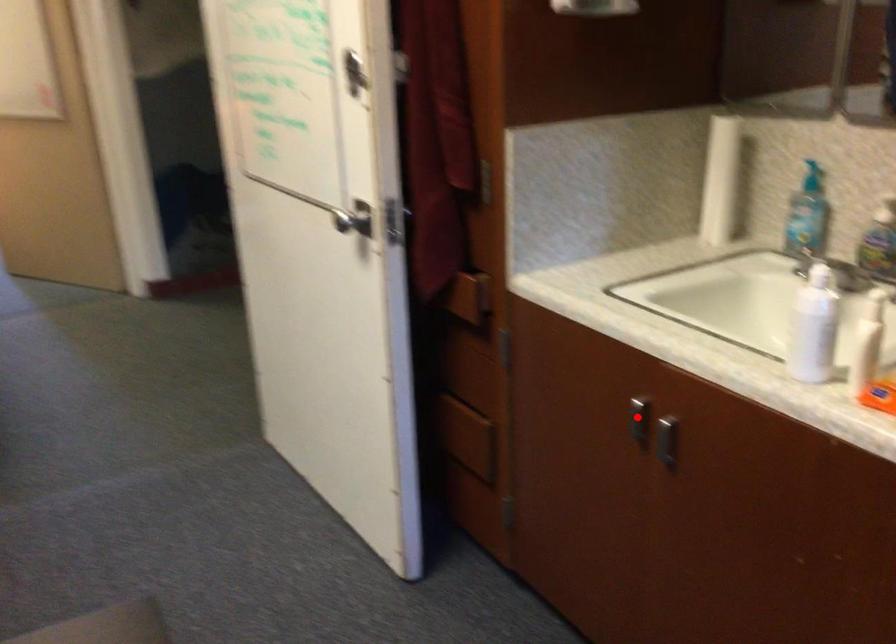
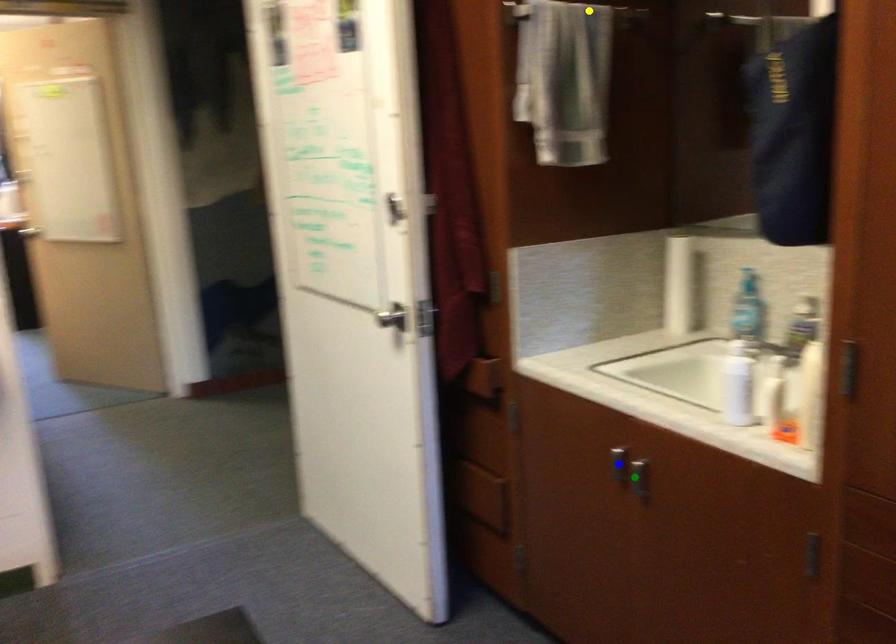
Question: I am providing you with two images of the same scene from different viewpoints. A red point is marked on the first image. You are given multiple points on the second image. Which mark in image 2 goes with the point in image 1?

Choices:
 (A) green point
 (B) blue point
 (C) yellow point

Answer: (B)